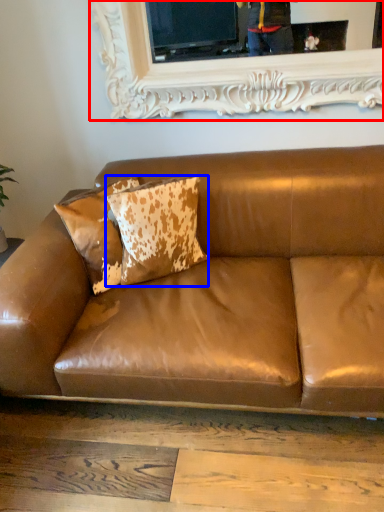
Question: Among these objects, which one is nearest to the camera, picture frame (highlighted by a red box) or pillow (highlighted by a blue box)?

Choices:
 (A) picture frame
 (B) pillow

Answer: (B)